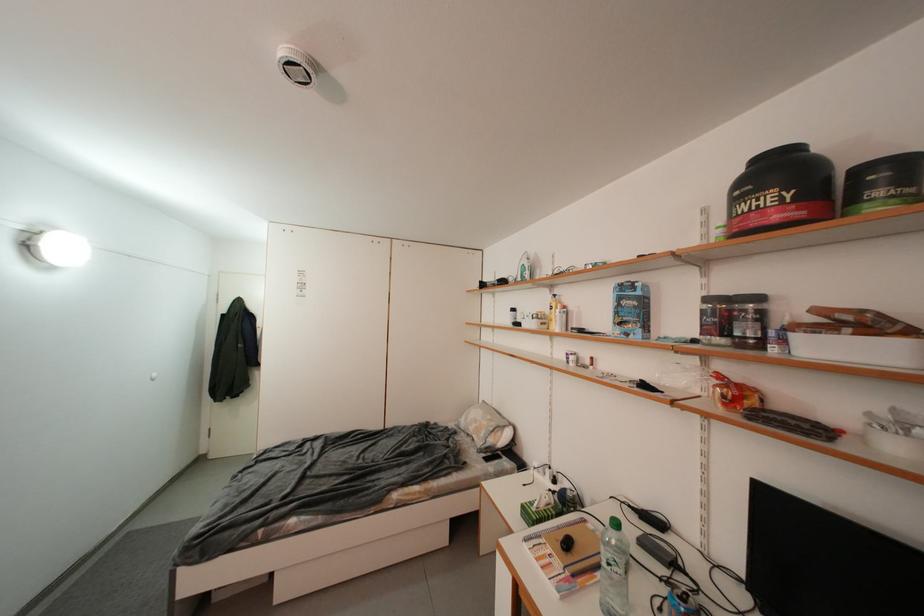
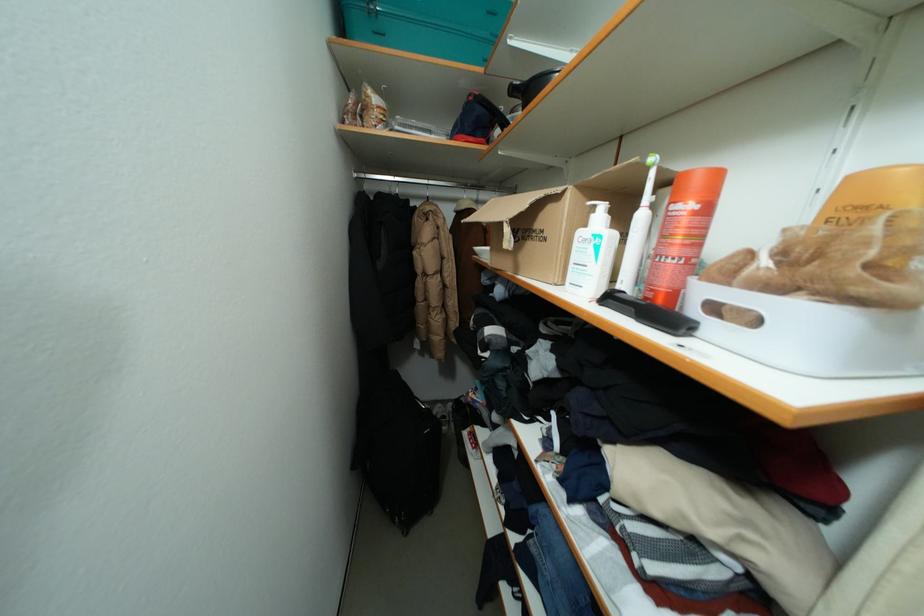
Question: I am providing you with two images of the same scene from different viewpoints. After the viewpoint changes to image2, which objects are now occluded?

Choices:
 (A) brown supplement jar
 (B) white bottle pump
 (C) black electric trimmer
 (D) gray bucket

Answer: (A)